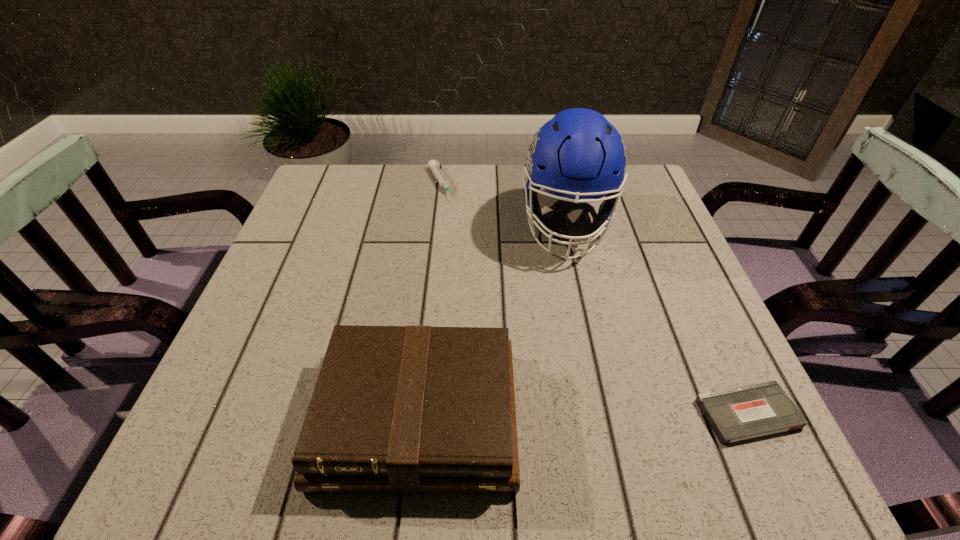
The height and width of the screenshot is (540, 960). In order to click on unoccupied position between the second object from right to left and the shortest object in this screenshot , I will do `click(657, 319)`.

The width and height of the screenshot is (960, 540). What are the coordinates of `free space between the syringe and the shortest object` in the screenshot? It's located at (594, 299).

Image resolution: width=960 pixels, height=540 pixels. Identify the location of empty space that is in between the rightmost object and the second shortest object. (594, 299).

The image size is (960, 540). In order to click on free space between the second object from right to left and the syringe in this screenshot , I will do `click(503, 204)`.

Where is `free point between the tallest object and the rightmost object`? free point between the tallest object and the rightmost object is located at coordinates (657, 319).

I want to click on unoccupied position between the second tallest object and the third object from left to right, so click(x=492, y=320).

Locate which object ranks in proximity to the syringe. Please provide its 2D coordinates. Your answer should be formatted as a tuple, i.e. [(x, y)], where the tuple contains the x and y coordinates of a point satisfying the conditions above.

[(578, 154)]

Find the location of a particular element. The height and width of the screenshot is (540, 960). object that is the third closest to the football helmet is located at coordinates (738, 414).